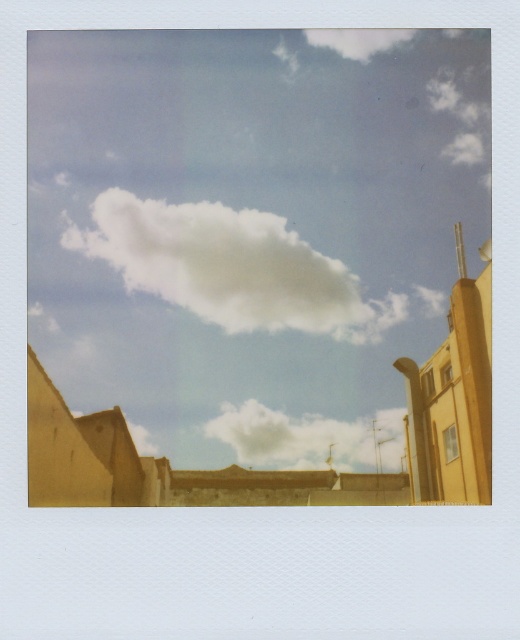
You are a drone operator planning to fly a drone between the white fluffy cloud at upper center and the white fluffy cloud at center. Given that the drone has a maximum flight range of 100 meters, can it safely travel between them without running out of battery?

The distance between the white fluffy cloud at upper center and the white fluffy cloud at center is 88.11 meters, which is within the drone operator drone has a maximum flight range of 100 meters. The drone can safely travel between them without running out of battery.

You are looking at a Polaroid photo of an outdoor urban scene. You notice two clouds in the sky. The first is the white fluffy cloud at upper center, and the second is the white fluffy cloud at center. Which cloud is located to the left of the other?

The white fluffy cloud at upper center is positioned on the left side of white fluffy cloud at center.